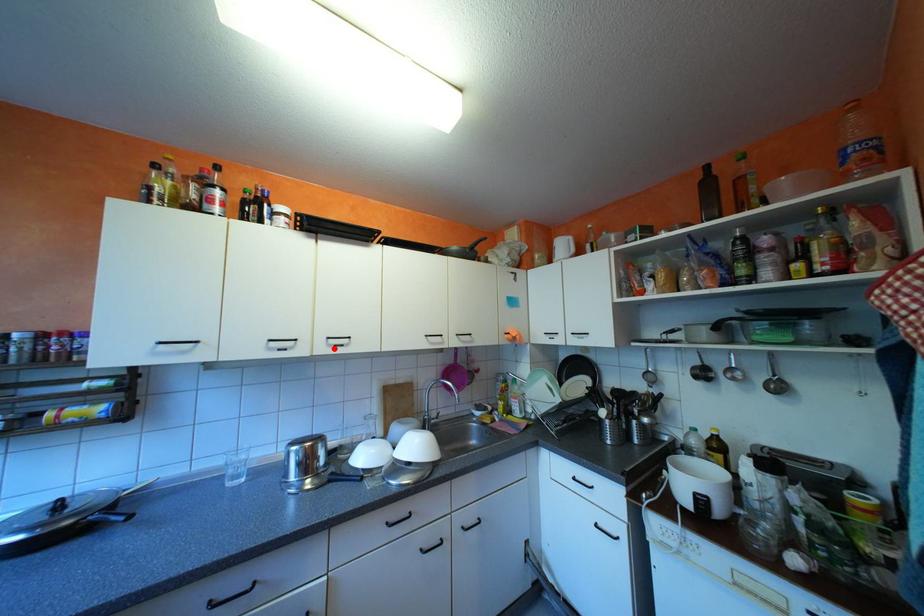
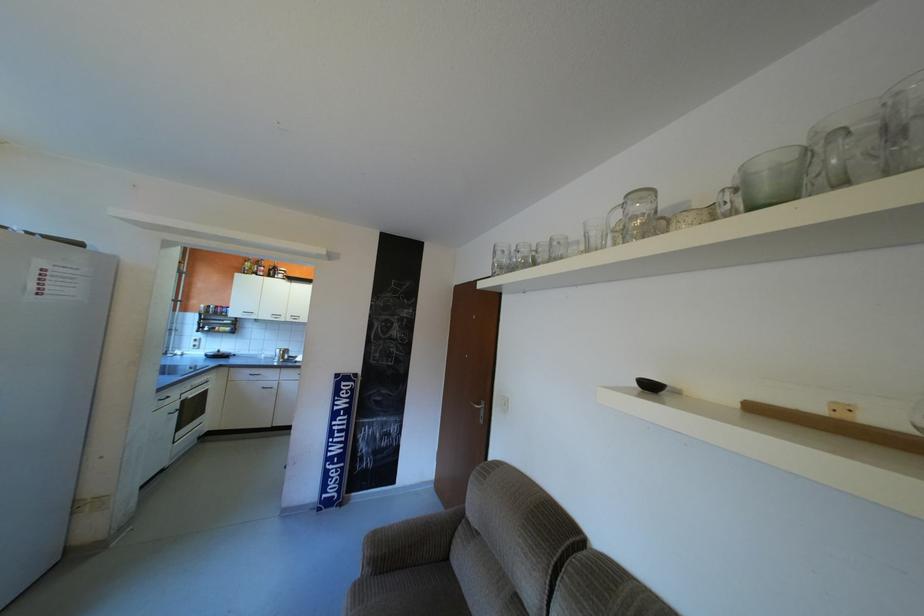
Find the pixel in the second image that matches the highlighted location in the first image.

(300, 318)